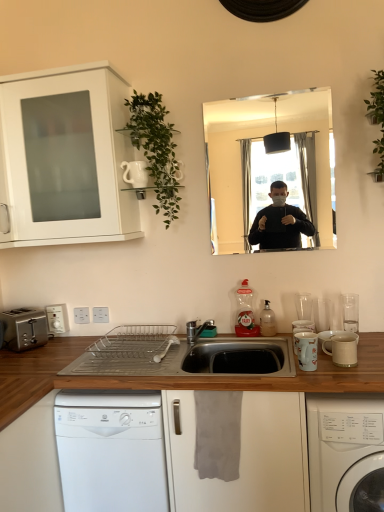
Image resolution: width=384 pixels, height=512 pixels. I want to click on unoccupied area in front of white ceramic mug at right, arranged as the 3th appliance when viewed from the top, so click(342, 375).